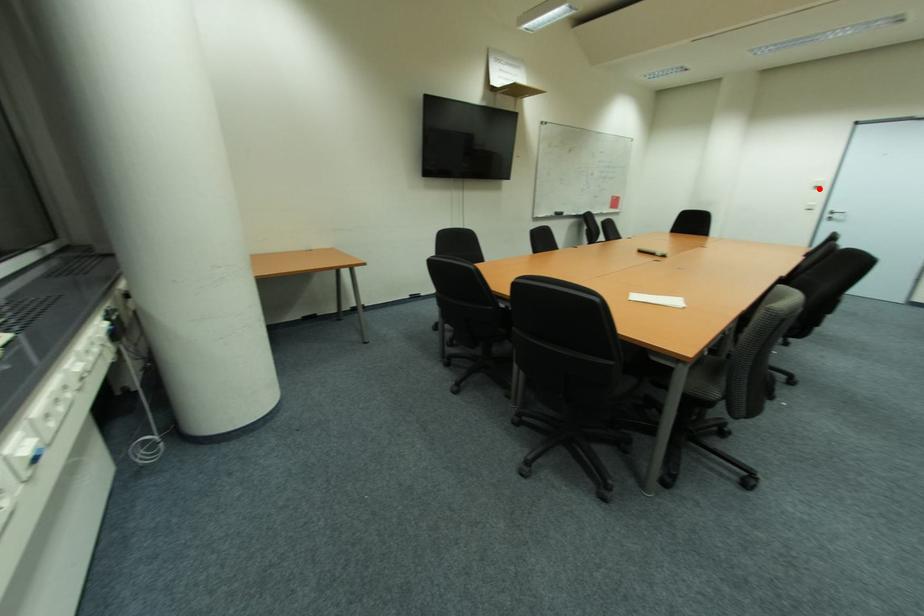
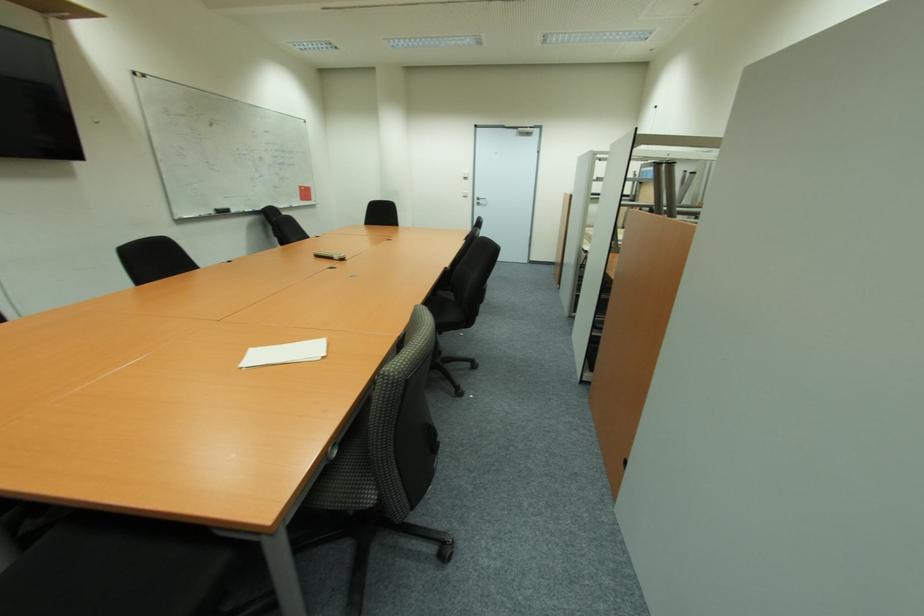
In the second image, find the point that corresponds to the highlighted location in the first image.

(467, 179)